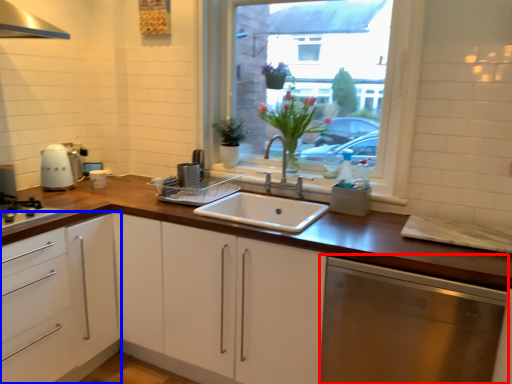
Question: Among these objects, which one is farthest to the camera, dish washer (highlighted by a red box) or cabinetry (highlighted by a blue box)?

Choices:
 (A) dish washer
 (B) cabinetry

Answer: (B)